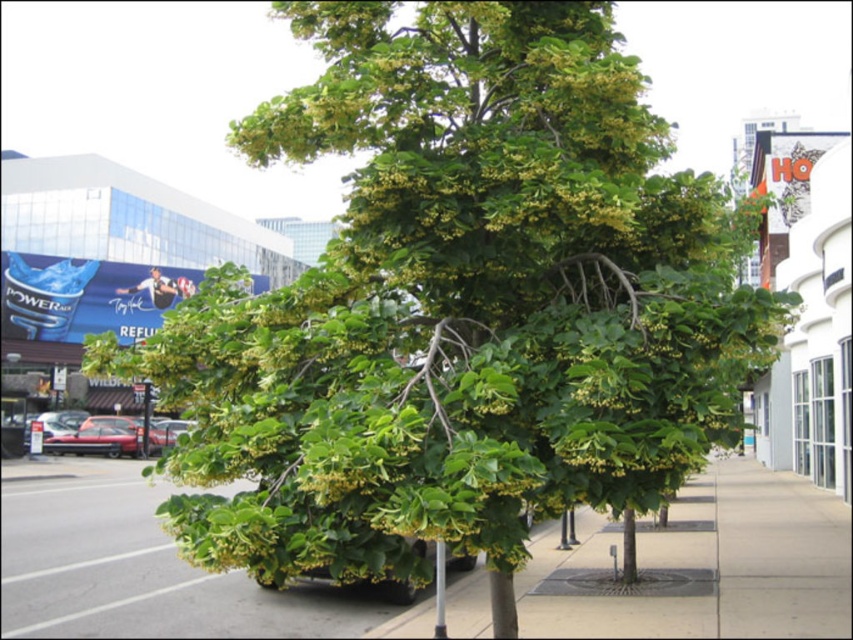
You are a GUI agent. You are given a task and a screenshot of the screen. Output one action in this format:
    pyautogui.click(x=<x>, y=<y>)
    Task: Click on the green leafy tree at center
    The image size is (853, 640).
    Given the screenshot: What is the action you would take?
    pyautogui.click(x=708, y=564)

Is green leafy tree at center bigger than metallic silver pole at lower center?

Yes.

I want to click on green leafy tree at center, so click(x=708, y=564).